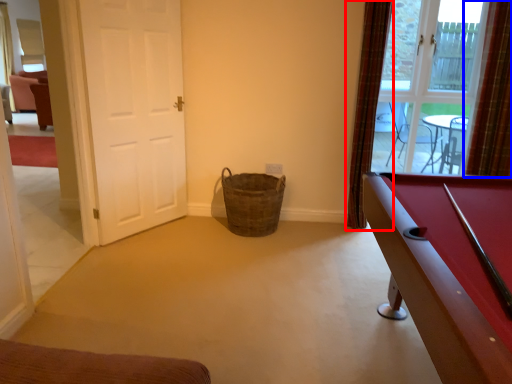
Question: Which of the following is the closest to the observer, curtain (highlighted by a red box) or curtain (highlighted by a blue box)?

Choices:
 (A) curtain
 (B) curtain

Answer: (B)